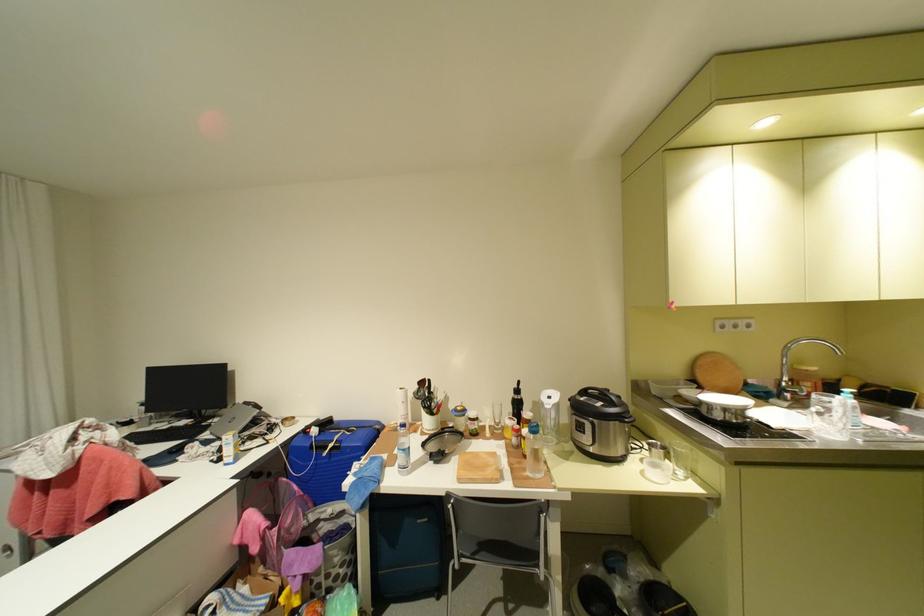
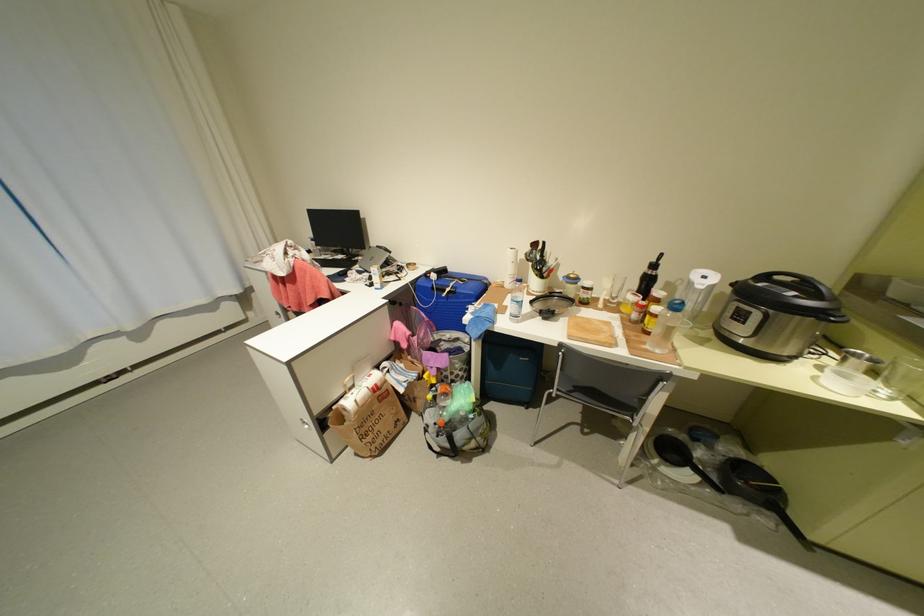
Where in the second image is the point corresponding to pixel 517 445 from the first image?

(633, 318)